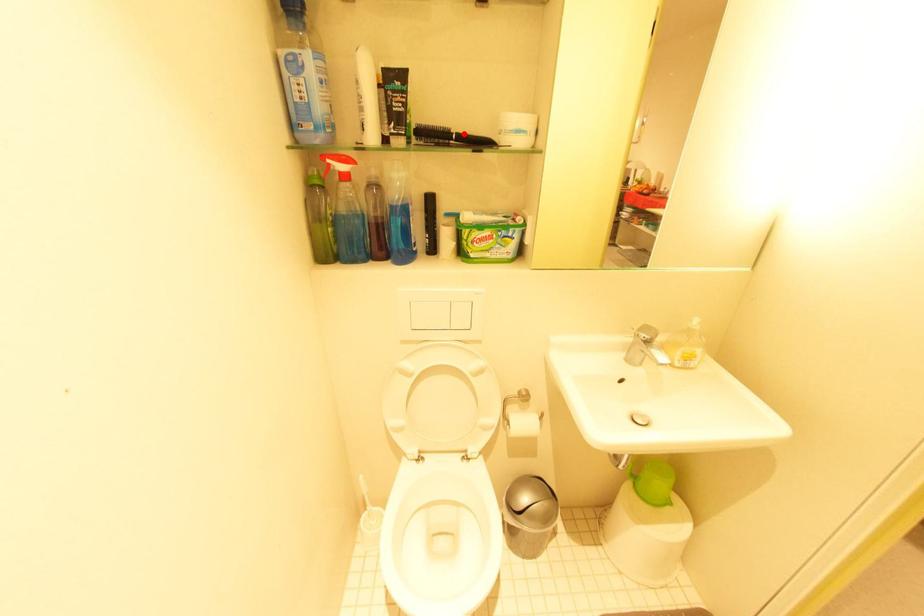
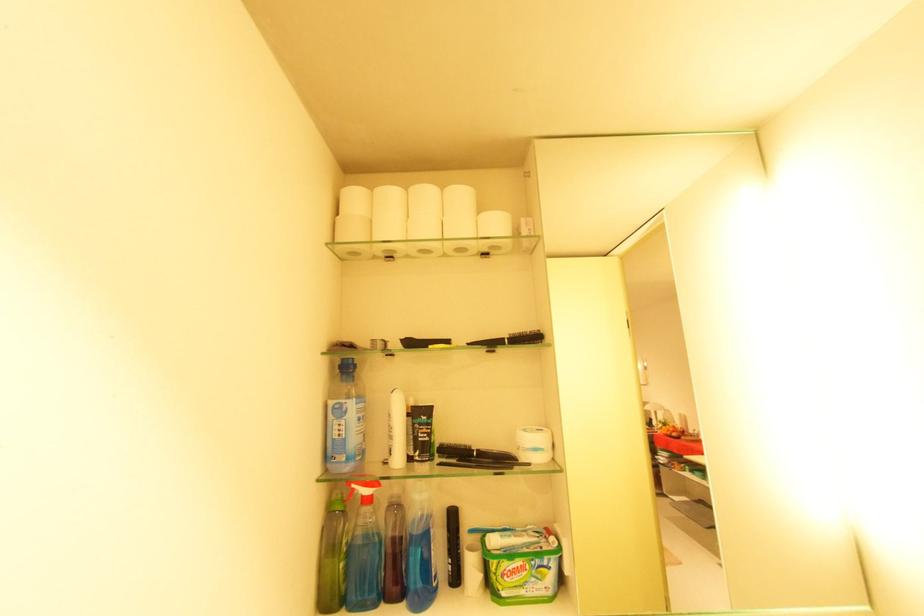
Find the pixel in the second image that matches the highlighted location in the first image.

(484, 451)